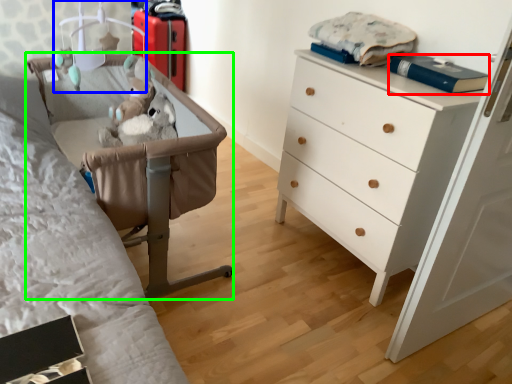
Question: Which is nearer to the book (highlighted by a red box)? lamp (highlighted by a blue box) or furniture (highlighted by a green box).

Choices:
 (A) lamp
 (B) furniture

Answer: (B)